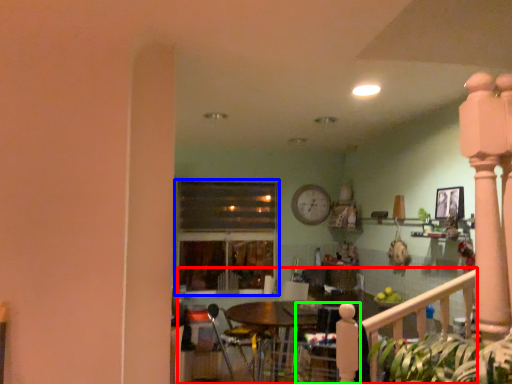
Question: Considering the real-world distances, which object is closest to porch (highlighted by a red box)? window (highlighted by a blue box) or armchair (highlighted by a green box).

Choices:
 (A) window
 (B) armchair

Answer: (B)